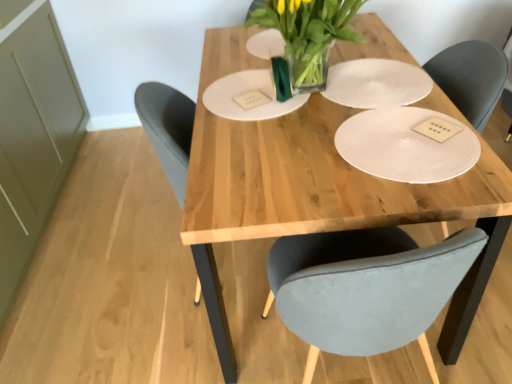
Find the location of a particular element. The image size is (512, 384). vacant space that is to the left of white textured plate at center is located at coordinates (277, 180).